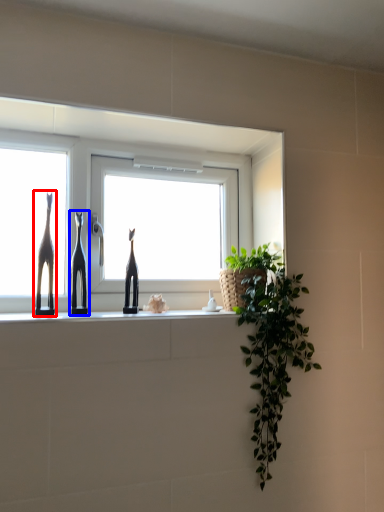
Question: Which point is further to the camera, giraffe (highlighted by a red box) or sculpture (highlighted by a blue box)?

Choices:
 (A) giraffe
 (B) sculpture

Answer: (B)